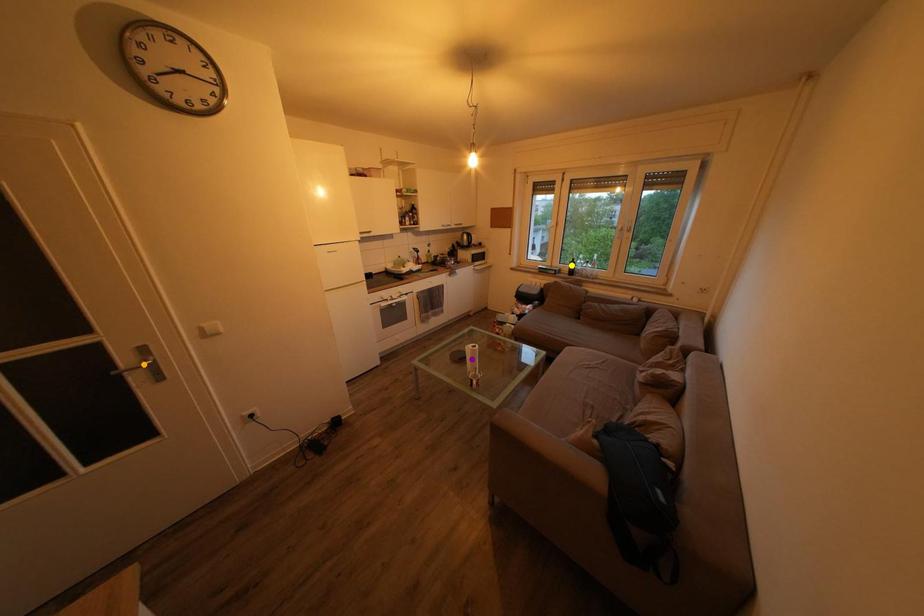
From the picture: Order these from nearest to farthest:
A) orange point
B) yellow point
C) purple point

orange point → purple point → yellow point